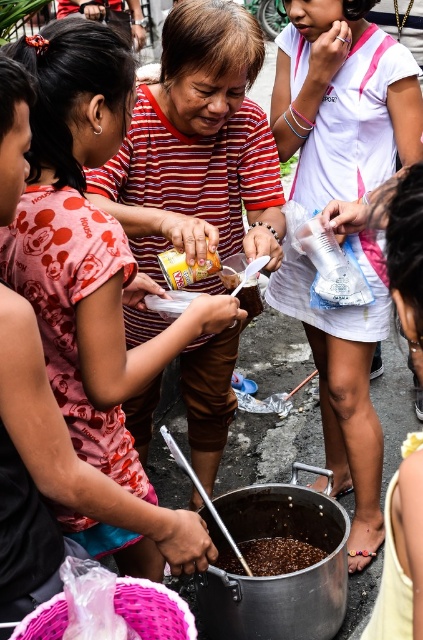
You are a photographer standing in the scene wanting to capture both the white cotton shirt at center and the brown matte rice at center in a single frame. What is the minimum distance you need to move backward to ensure both objects are fully visible?

The white cotton shirt at center and the brown matte rice at center are 34.60 inches apart. To capture both in a single frame, you need to move backward until the distance between them fits within your camera lens view. The exact distance depends on your camera lens specifications, but the separation between the objects is 34.60 inches.

You are a fashion designer observing the scene. You need to determine if the striped fabric shirt at center can be folded and placed into a container holding brown matte rice at center without any part of the shirt being visible. Based on the sizes provided, can this be done?

The striped fabric shirt at center is larger in width than the brown matte rice at center, so it cannot be fully folded and placed into the container holding the brown matte rice at center without some part of the shirt remaining visible.

Where is the striped fabric shirt at center located in terms of coordinates?

The striped fabric shirt at center is located at coordinates point (197, 147).